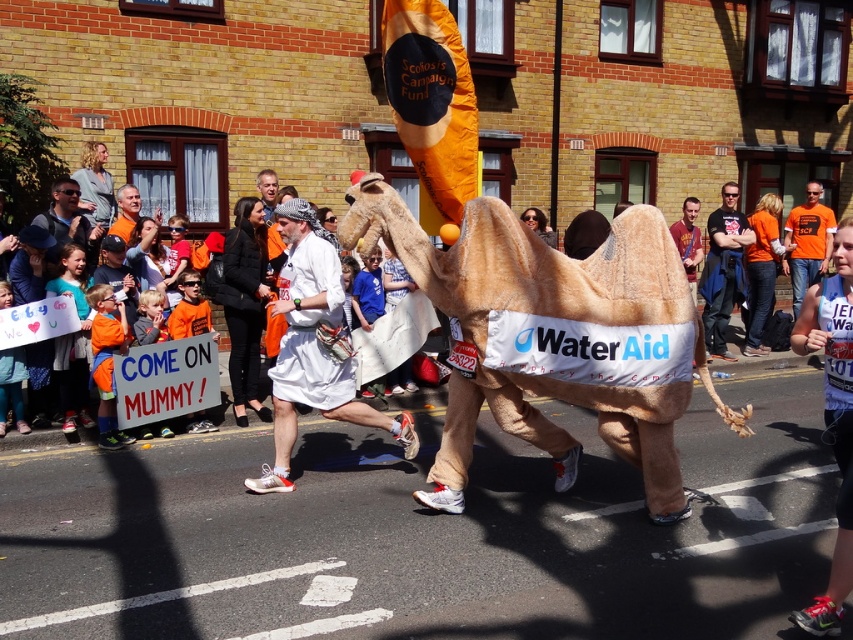
Question: Is orange cotton t-shirt at center positioned at the back of orange fabric camel at center?

Choices:
 (A) no
 (B) yes

Answer: (B)

Question: Which point appears farthest from the camera in this image?

Choices:
 (A) (694, 234)
 (B) (704, 276)
 (C) (62, 221)
 (D) (259, 176)

Answer: (B)

Question: From the image, what is the correct spatial relationship of orange cotton t-shirt at center in relation to orange fabric camel at center?

Choices:
 (A) above
 (B) below

Answer: (A)

Question: Which of the following is the farthest from the observer?

Choices:
 (A) orange fabric camel at center
 (B) matte white shirt at center

Answer: (A)

Question: Among these objects, which one is farthest from the camera?

Choices:
 (A) orange fabric camel at center
 (B) white fabric runner at center
 (C) matte white shirt at center

Answer: (A)

Question: Is orange fabric camel at center wider than orange fabric man at center?

Choices:
 (A) yes
 (B) no

Answer: (A)